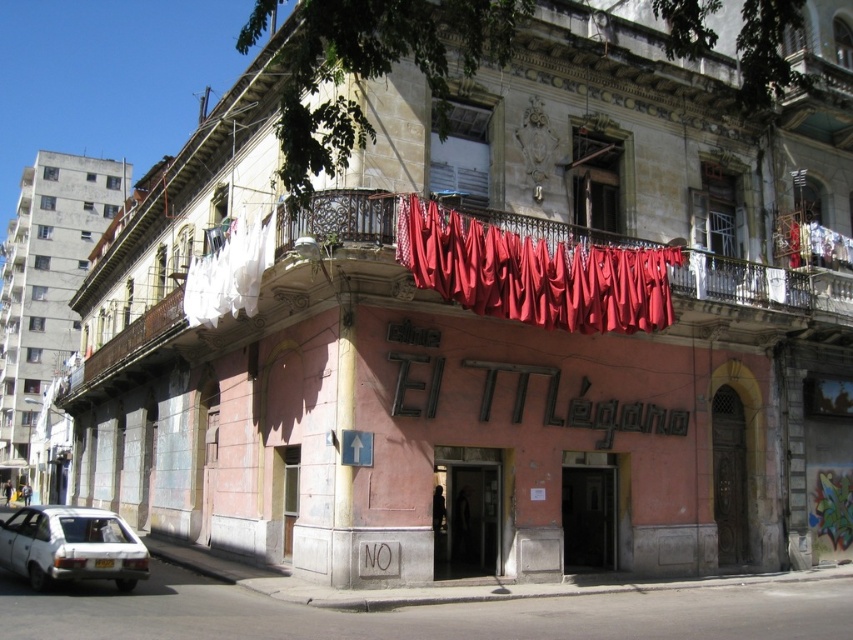
Question: Is red fabric at upper center above white matte car at lower left?

Choices:
 (A) no
 (B) yes

Answer: (B)

Question: Can you confirm if red fabric at upper center is wider than white matte car at lower left?

Choices:
 (A) yes
 (B) no

Answer: (A)

Question: Considering the relative positions of red fabric at upper center and white matte car at lower left in the image provided, where is red fabric at upper center located with respect to white matte car at lower left?

Choices:
 (A) below
 (B) above

Answer: (B)

Question: Which point is farther from the camera taking this photo?

Choices:
 (A) (73, 541)
 (B) (631, 314)

Answer: (B)

Question: Among these objects, which one is farthest from the camera?

Choices:
 (A) white matte car at lower left
 (B) red fabric at upper center

Answer: (B)